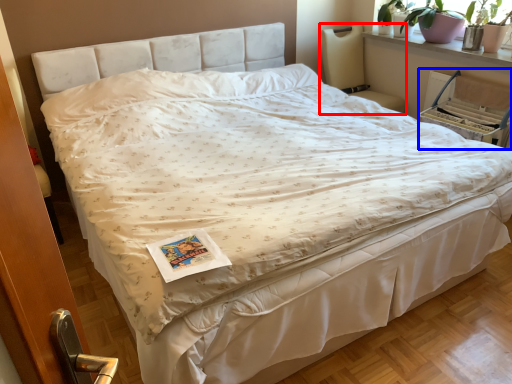
Question: Which object appears closest to the camera in this image, rocking chair (highlighted by a red box) or armchair (highlighted by a blue box)?

Choices:
 (A) rocking chair
 (B) armchair

Answer: (B)